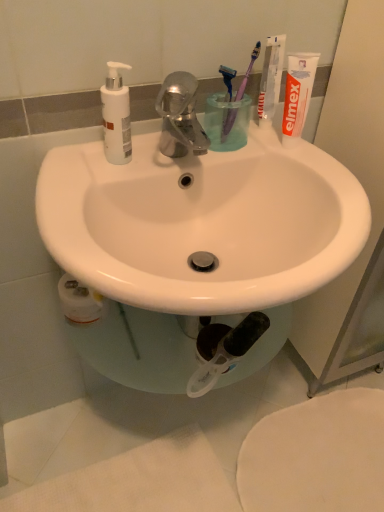
Where is `unoccupied region to the right of purple plastic toothbrush at upper right, which is the 2th toothbrush from right to left`? Image resolution: width=384 pixels, height=512 pixels. unoccupied region to the right of purple plastic toothbrush at upper right, which is the 2th toothbrush from right to left is located at coordinates (284, 148).